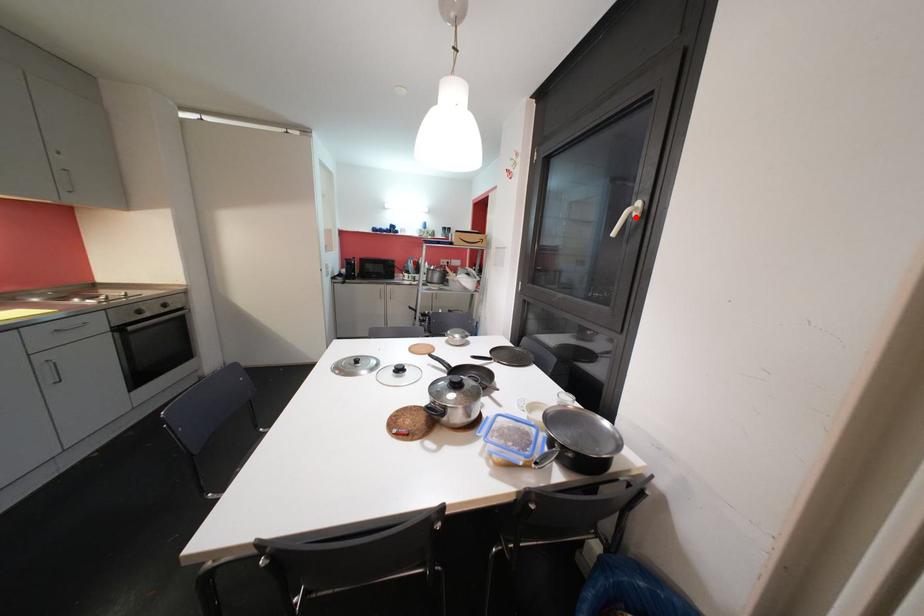
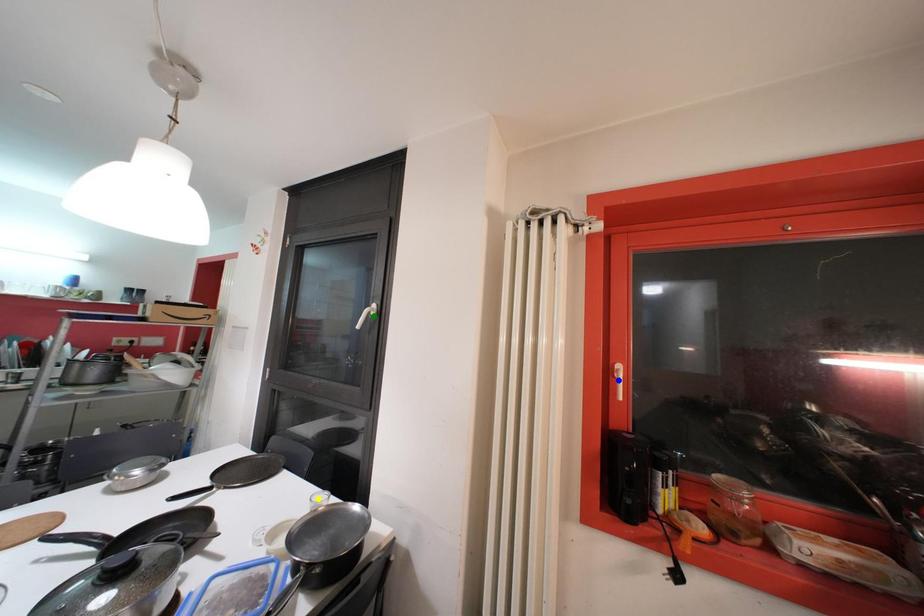
Question: I am providing you with two images of the same scene from different viewpoints. A red point is marked on the first image. You are given multiple points on the second image. Which point in image 2 is actually the same real-world point as the red point in image 1?

Choices:
 (A) blue point
 (B) green point
 (C) yellow point

Answer: (B)